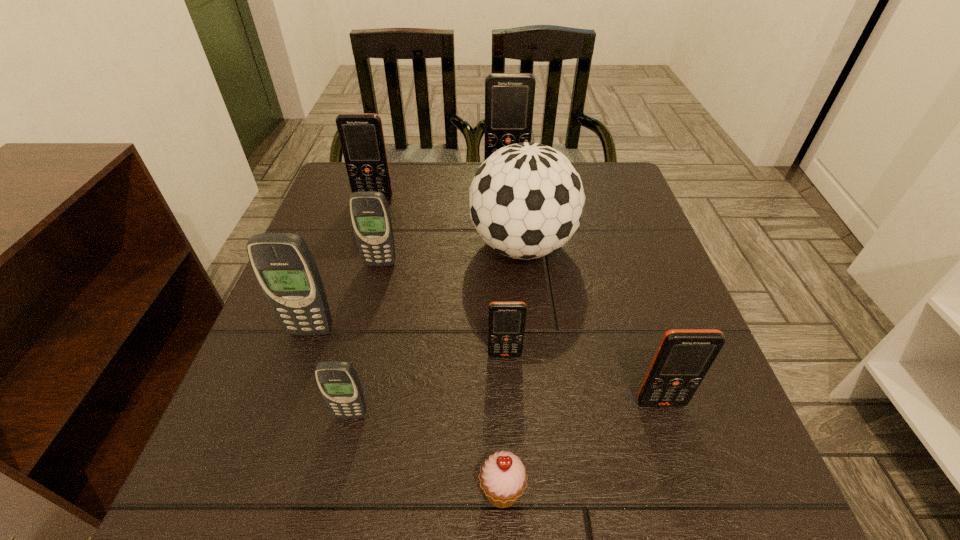
Find the location of a particular element. The height and width of the screenshot is (540, 960). the farthest orange cellular telephone is located at coordinates (509, 97).

Image resolution: width=960 pixels, height=540 pixels. In order to click on the farthest object in this screenshot , I will do `click(509, 97)`.

The height and width of the screenshot is (540, 960). Find the location of `black soccer ball`. black soccer ball is located at coordinates (526, 200).

Find the location of a particular element. This screenshot has height=540, width=960. the third smallest orange cellular telephone is located at coordinates (361, 135).

Locate an element on the screen. the leftmost orange cellular telephone is located at coordinates (361, 135).

Locate an element on the screen. This screenshot has height=540, width=960. the fourth farthest cellular telephone is located at coordinates (283, 264).

The height and width of the screenshot is (540, 960). In order to click on the fifth farthest object in this screenshot , I will do `click(283, 264)`.

Where is `the second biggest gray cellular telephone`? the second biggest gray cellular telephone is located at coordinates (369, 211).

You are a GUI agent. You are given a task and a screenshot of the screen. Output one action in this format:
    pyautogui.click(x=<x>, y=<y>)
    Task: Click on the farthest gray cellular telephone
    This screenshot has height=540, width=960.
    Given the screenshot: What is the action you would take?
    pyautogui.click(x=369, y=211)

The width and height of the screenshot is (960, 540). I want to click on the rightmost cellular telephone, so click(684, 356).